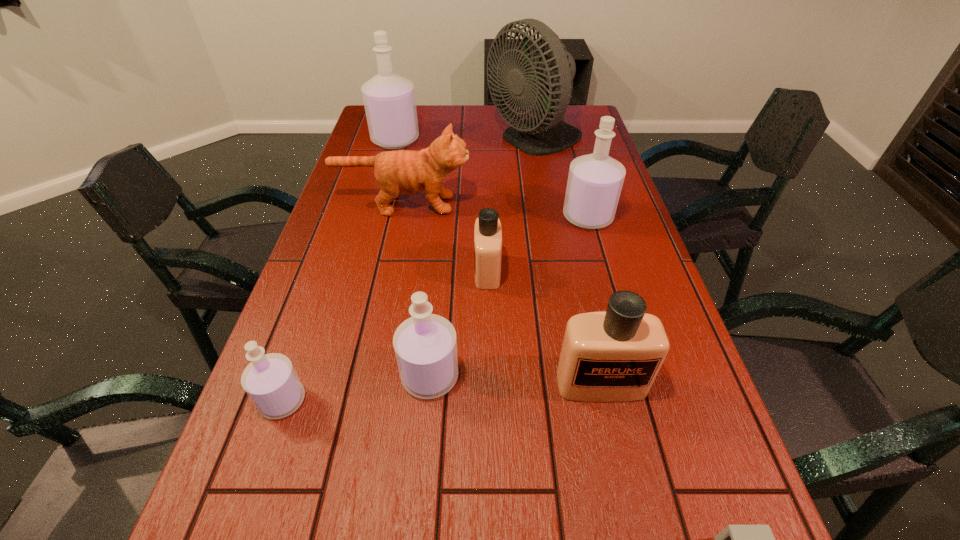
You are a GUI agent. You are given a task and a screenshot of the screen. Output one action in this format:
    pyautogui.click(x=<x>, y=<y>)
    Task: Click on the fan
    This screenshot has width=960, height=540.
    Given the screenshot: What is the action you would take?
    pyautogui.click(x=541, y=73)

This screenshot has height=540, width=960. What are the coordinates of `the farthest perfume` in the screenshot? It's located at (389, 99).

Locate an element on the screen. The width and height of the screenshot is (960, 540). the farthest purple perfume is located at coordinates (389, 99).

The image size is (960, 540). Identify the location of the third smallest purple perfume. (595, 181).

The image size is (960, 540). What are the coordinates of `the rightmost purple perfume` in the screenshot? It's located at (595, 181).

The height and width of the screenshot is (540, 960). Find the location of `ginger cat`. ginger cat is located at coordinates (404, 172).

Identify the location of the third perfume from left to right. coord(425,345).

At what (x,y) coordinates should I click in order to perform the action: click on the third purple perfume from left to right. Please return your answer as a coordinate pair (x, y). Looking at the image, I should click on (425, 345).

At what (x,y) coordinates should I click in order to perform the action: click on the right beige perfume. Please return your answer as a coordinate pair (x, y). Image resolution: width=960 pixels, height=540 pixels. Looking at the image, I should click on (612, 356).

Image resolution: width=960 pixels, height=540 pixels. I want to click on the bigger beige perfume, so click(x=612, y=356).